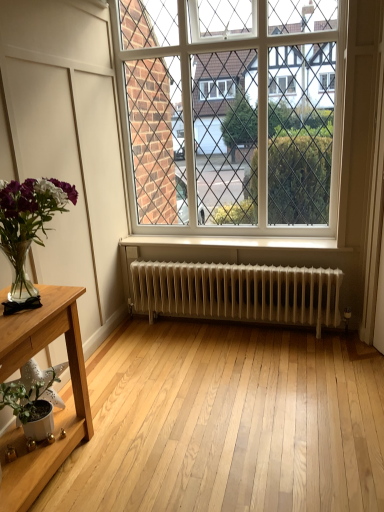
Question: Is light wood table at lower left bigger or smaller than white glass window at center?

Choices:
 (A) small
 (B) big

Answer: (A)

Question: From a real-world perspective, relative to white glass window at center, is light wood table at lower left vertically above or below?

Choices:
 (A) above
 (B) below

Answer: (B)

Question: Based on their relative distances, which object is farther from the white matte pot at lower left, acting as the second houseplant starting from the top?

Choices:
 (A) translucent glass vase at left, the second houseplant when ordered from bottom to top
 (B) white glass window at center
 (C) light wood table at lower left
 (D) white metallic radiator at center

Answer: (B)

Question: Which object is positioned closest to the white metallic radiator at center?

Choices:
 (A) light wood table at lower left
 (B) white matte pot at lower left, the first houseplant when ordered from bottom to top
 (C) white glass window at center
 (D) translucent glass vase at left, the second houseplant when ordered from bottom to top

Answer: (C)